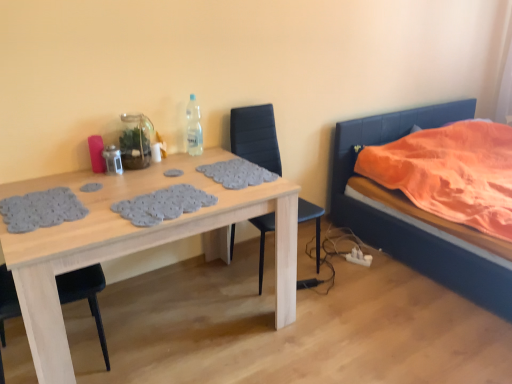
Question: From the image's perspective, does wooden table at center appear lower than black leather chair at center?

Choices:
 (A) yes
 (B) no

Answer: (A)

Question: Can you confirm if wooden table at center is positioned to the right of black leather chair at center?

Choices:
 (A) yes
 (B) no

Answer: (B)

Question: Would you say wooden table at center contains black leather chair at center?

Choices:
 (A) yes
 (B) no

Answer: (B)

Question: Considering the relative sizes of wooden table at center and black leather chair at center in the image provided, is wooden table at center bigger than black leather chair at center?

Choices:
 (A) no
 (B) yes

Answer: (B)

Question: From a real-world perspective, is wooden table at center on top of black leather chair at center?

Choices:
 (A) no
 (B) yes

Answer: (A)

Question: Considering their positions, is black leather chair at center located in front of or behind clear plastic bottle at upper center?

Choices:
 (A) behind
 (B) front

Answer: (B)

Question: From their relative heights in the image, would you say black leather chair at center is taller or shorter than clear plastic bottle at upper center?

Choices:
 (A) tall
 (B) short

Answer: (A)

Question: Visually, is black leather chair at center positioned to the left or to the right of clear plastic bottle at upper center?

Choices:
 (A) left
 (B) right

Answer: (B)

Question: From the image's perspective, relative to clear plastic bottle at upper center, is black leather chair at center above or below?

Choices:
 (A) above
 (B) below

Answer: (B)

Question: Relative to black leather chair at center, is wooden table at center in front or behind?

Choices:
 (A) behind
 (B) front

Answer: (B)

Question: Would you say wooden table at center is inside or outside black leather chair at center?

Choices:
 (A) inside
 (B) outside

Answer: (B)

Question: Would you say wooden table at center is to the left or to the right of black leather chair at center in the picture?

Choices:
 (A) right
 (B) left

Answer: (B)

Question: Looking at the image, does wooden table at center seem bigger or smaller compared to black leather chair at center?

Choices:
 (A) big
 (B) small

Answer: (A)

Question: In terms of width, does orange fabric bed at right look wider or thinner when compared to black leather chair at center?

Choices:
 (A) wide
 (B) thin

Answer: (A)

Question: Do you think orange fabric bed at right is within black leather chair at center, or outside of it?

Choices:
 (A) outside
 (B) inside

Answer: (A)